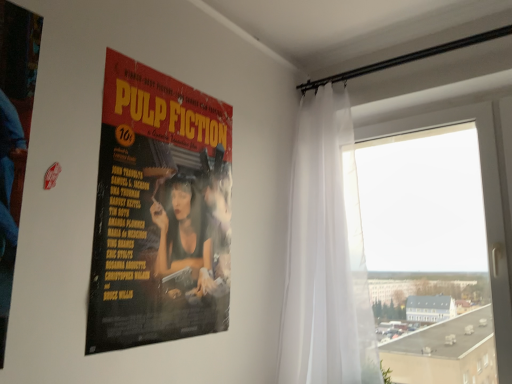
Question: Does matte paper poster at center have a larger size compared to transparent glass window at right?

Choices:
 (A) no
 (B) yes

Answer: (A)

Question: From a real-world perspective, is matte paper poster at center located beneath transparent glass window at right?

Choices:
 (A) no
 (B) yes

Answer: (A)

Question: Is matte paper poster at center taller than transparent glass window at right?

Choices:
 (A) yes
 (B) no

Answer: (B)

Question: Is matte paper poster at center further to the viewer compared to transparent glass window at right?

Choices:
 (A) no
 (B) yes

Answer: (A)

Question: Is matte paper poster at center outside of transparent glass window at right?

Choices:
 (A) no
 (B) yes

Answer: (B)

Question: From the image's perspective, is matte paper poster at center below transparent glass window at right?

Choices:
 (A) no
 (B) yes

Answer: (A)

Question: Is white sheer curtain at right oriented towards matte paper poster at center?

Choices:
 (A) yes
 (B) no

Answer: (A)

Question: From the image's perspective, would you say white sheer curtain at right is shown under matte paper poster at center?

Choices:
 (A) no
 (B) yes

Answer: (B)

Question: Does white sheer curtain at right come in front of matte paper poster at center?

Choices:
 (A) yes
 (B) no

Answer: (B)

Question: Is white sheer curtain at right located outside matte paper poster at center?

Choices:
 (A) yes
 (B) no

Answer: (A)

Question: Can you confirm if white sheer curtain at right is shorter than matte paper poster at center?

Choices:
 (A) no
 (B) yes

Answer: (A)

Question: Are white sheer curtain at right and matte paper poster at center located far from each other?

Choices:
 (A) no
 (B) yes

Answer: (A)

Question: Is matte paper poster at center closer to the viewer compared to white sheer curtain at right?

Choices:
 (A) yes
 (B) no

Answer: (A)